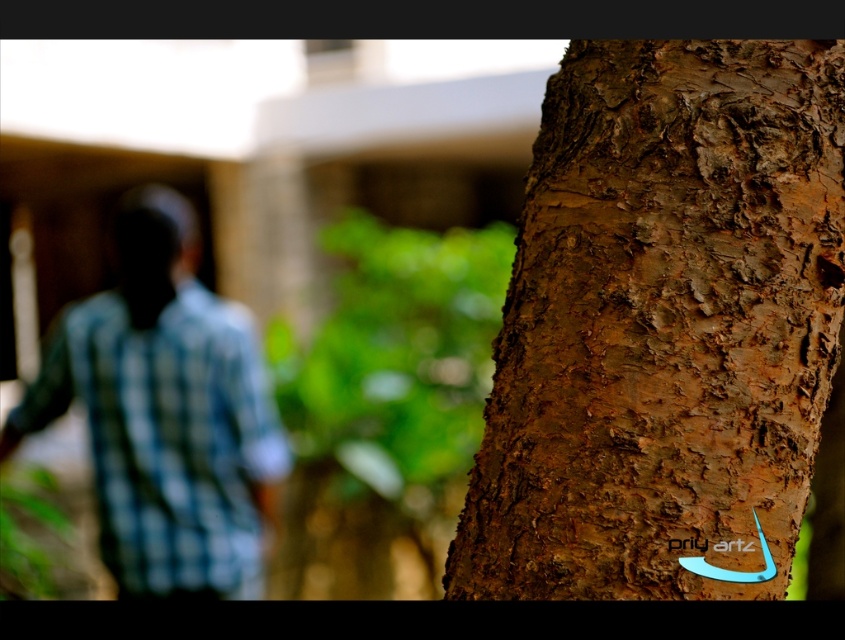
You are standing in a forest and see the brown rough bark at right and the blue checkered shirt at left. Which object is higher in the image?

The brown rough bark at right is located above the blue checkered shirt at left, so it is higher in the image.

You are standing in a forest and see the brown rough bark at right and the blue checkered shirt at left. Which object is shorter?

The brown rough bark at right is shorter than the blue checkered shirt at left.